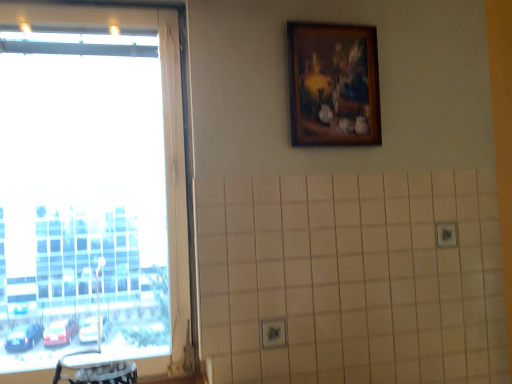
What do you see at coordinates (333, 85) in the screenshot? I see `wooden picture frame at upper center` at bounding box center [333, 85].

This screenshot has height=384, width=512. In order to click on wooden picture frame at upper center in this screenshot , I will do `click(333, 85)`.

This screenshot has width=512, height=384. What do you see at coordinates (166, 149) in the screenshot?
I see `transparent glass window at left` at bounding box center [166, 149].

Where is `transparent glass window at left`? This screenshot has height=384, width=512. transparent glass window at left is located at coordinates (166, 149).

Identify the location of wooden picture frame at upper center. The height and width of the screenshot is (384, 512). (333, 85).

In the scene shown: Visually, is transparent glass window at left positioned to the left or to the right of wooden picture frame at upper center?

Clearly, transparent glass window at left is on the left of wooden picture frame at upper center in the image.

Which is in front, transparent glass window at left or wooden picture frame at upper center?

Positioned in front is transparent glass window at left.

Considering the points (110, 21) and (300, 77), which point is in front, point (110, 21) or point (300, 77)?

The point (110, 21) is closer to the camera.

From the picture: From the image's perspective, would you say transparent glass window at left is shown under wooden picture frame at upper center?

Yes, from the image's perspective, transparent glass window at left is below wooden picture frame at upper center.

From a real-world perspective, which is physically below, transparent glass window at left or wooden picture frame at upper center?

In real-world perspective, transparent glass window at left is lower.

Between transparent glass window at left and wooden picture frame at upper center, which one has smaller width?

Thinner between the two is wooden picture frame at upper center.

Does transparent glass window at left have a lesser height compared to wooden picture frame at upper center?

No.

Between transparent glass window at left and wooden picture frame at upper center, which one has smaller size?

wooden picture frame at upper center is smaller.

From the picture: Is transparent glass window at left completely or partially outside of wooden picture frame at upper center?

Yes, transparent glass window at left is located beyond the bounds of wooden picture frame at upper center.

Are transparent glass window at left and wooden picture frame at upper center far apart?

They are positioned close to each other.

Is transparent glass window at left facing away from wooden picture frame at upper center?

No, wooden picture frame at upper center is not at the back of transparent glass window at left.

What's the angular difference between transparent glass window at left and wooden picture frame at upper center's facing directions?

0.244 degrees.

You are a GUI agent. You are given a task and a screenshot of the screen. Output one action in this format:
    pyautogui.click(x=<x>, y=<y>)
    Task: Click on the picture frame on the right of transparent glass window at left
    The image size is (512, 384).
    Given the screenshot: What is the action you would take?
    pyautogui.click(x=333, y=85)

In the image, is wooden picture frame at upper center on the left side or the right side of transparent glass window at left?

Clearly, wooden picture frame at upper center is on the right of transparent glass window at left in the image.

Considering the positions of objects wooden picture frame at upper center and transparent glass window at left in the image provided, who is in front, wooden picture frame at upper center or transparent glass window at left?

transparent glass window at left is in front.

Does point (376, 121) come farther from viewer compared to point (185, 172)?

Yes, it is.

From the image's perspective, does wooden picture frame at upper center appear higher than transparent glass window at left?

Yes, from the image's perspective, wooden picture frame at upper center is over transparent glass window at left.

From the picture: From a real-world perspective, is wooden picture frame at upper center physically located above or below transparent glass window at left?

Clearly, from a real-world perspective, wooden picture frame at upper center is above transparent glass window at left.

Is wooden picture frame at upper center thinner than transparent glass window at left?

Indeed, wooden picture frame at upper center has a lesser width compared to transparent glass window at left.

Is wooden picture frame at upper center shorter than transparent glass window at left?

Yes, wooden picture frame at upper center is shorter than transparent glass window at left.

In the scene shown: Who is smaller, wooden picture frame at upper center or transparent glass window at left?

wooden picture frame at upper center is smaller.

Would you say transparent glass window at left is part of wooden picture frame at upper center's contents?

No.

Is wooden picture frame at upper center touching transparent glass window at left?

No, wooden picture frame at upper center is not touching transparent glass window at left.

Could you tell me if wooden picture frame at upper center is facing transparent glass window at left?

No, wooden picture frame at upper center is not facing towards transparent glass window at left.

How many degrees apart are the facing directions of wooden picture frame at upper center and transparent glass window at left?

The facing directions of wooden picture frame at upper center and transparent glass window at left are 0.244 degrees apart.

Find the location of a particular element. The image size is (512, 384). picture frame lying above the transparent glass window at left (from the image's perspective) is located at coordinates (333, 85).

Find the location of a particular element. Image resolution: width=512 pixels, height=384 pixels. window below the wooden picture frame at upper center (from a real-world perspective) is located at coordinates (166, 149).

Where is `window located in front of the wooden picture frame at upper center`? window located in front of the wooden picture frame at upper center is located at coordinates (166, 149).